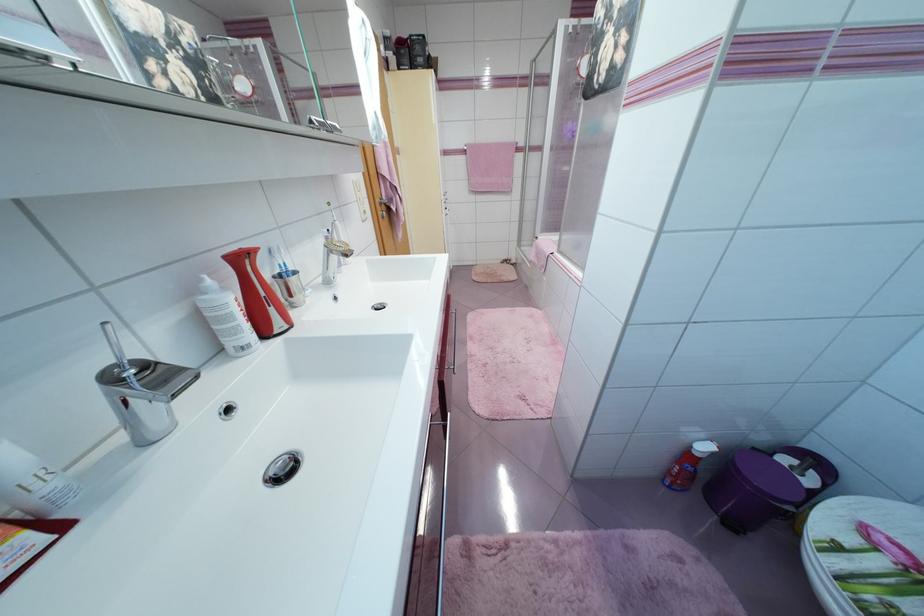
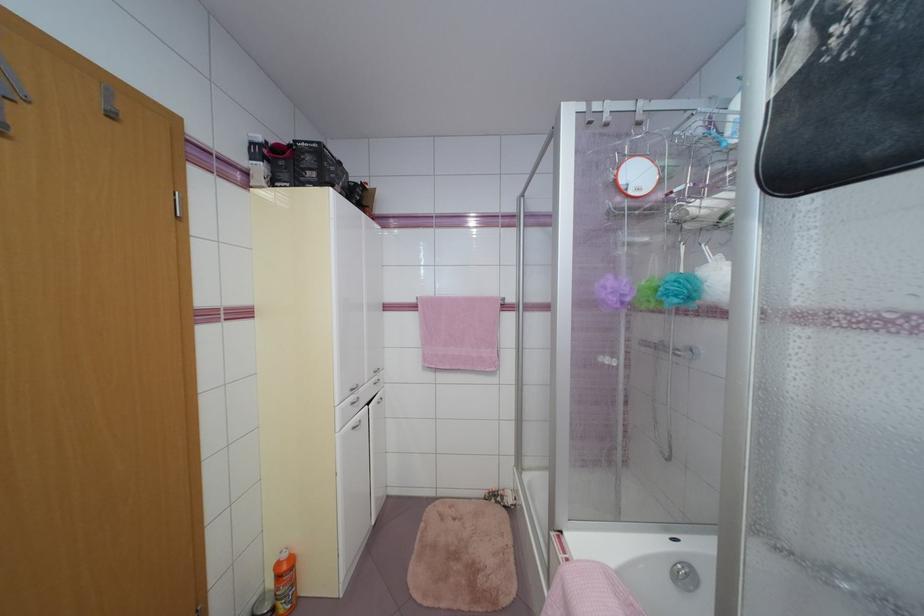
The point at (405,69) is marked in the first image. Where is the corresponding point in the second image?

(276, 185)